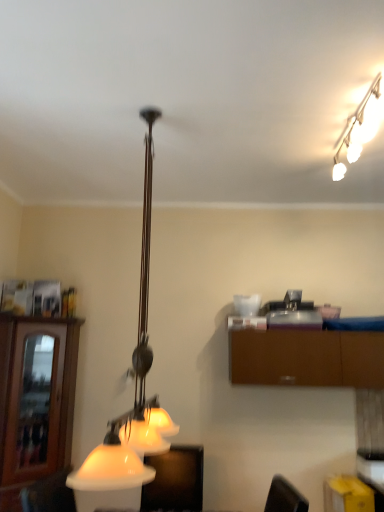
In order to face brown wood cabinet at left, which appears as the 2th cabinetry when viewed from the right, should I rotate leftwards or rightwards?

You should look left and rotate roughly 19.951 degrees.

This screenshot has width=384, height=512. In order to click on white glossy lamp at center, the 2th lamp in the right-to-left sequence in this screenshot , I will do `click(132, 379)`.

Identify the location of brown matte cabinet at upper right, acting as the second cabinetry starting from the left. This screenshot has width=384, height=512. (x=306, y=357).

Find the location of a particular element. The height and width of the screenshot is (512, 384). matte white lampshade at lower center is located at coordinates (175, 480).

The image size is (384, 512). Identify the location of brown wood cabinet at left, which is counted as the 1th cabinetry, starting from the left. (23, 404).

Consider the image. Is white frosted glass light fixture at upper right, which ranks as the 1th lamp in right-to-left order, not inside brown matte cabinet at upper right, acting as the second cabinetry starting from the left?

white frosted glass light fixture at upper right, which ranks as the 1th lamp in right-to-left order, lies outside brown matte cabinet at upper right, acting as the second cabinetry starting from the left,'s area.

In the scene shown: From the image's perspective, is white frosted glass light fixture at upper right, which is counted as the 2th lamp, starting from the left, over brown matte cabinet at upper right, the first cabinetry from the right?

Yes, from the image's perspective, white frosted glass light fixture at upper right, which is counted as the 2th lamp, starting from the left, is over brown matte cabinet at upper right, the first cabinetry from the right.

Would you say white frosted glass light fixture at upper right, which is counted as the 2th lamp, starting from the left, is to the left or to the right of brown matte cabinet at upper right, acting as the second cabinetry starting from the left, in the picture?

In the image, white frosted glass light fixture at upper right, which is counted as the 2th lamp, starting from the left, appears on the left side of brown matte cabinet at upper right, acting as the second cabinetry starting from the left.

Which is closer, (x=336, y=156) or (x=324, y=333)?

The point (x=336, y=156) is closer.

Considering the sizes of objects matte white lampshade at lower center and brown wood cabinet at left, which appears as the 2th cabinetry when viewed from the right, in the image provided, who is thinner, matte white lampshade at lower center or brown wood cabinet at left, which appears as the 2th cabinetry when viewed from the right,?

Thinner between the two is brown wood cabinet at left, which appears as the 2th cabinetry when viewed from the right.

Which object is positioned more to the right, matte white lampshade at lower center or brown wood cabinet at left, which is counted as the 1th cabinetry, starting from the left?

matte white lampshade at lower center is more to the right.

Consider the image. How different are the orientations of matte white lampshade at lower center and brown wood cabinet at left, which is counted as the 1th cabinetry, starting from the left, in degrees?

47.2 degrees.

Are matte white lampshade at lower center and brown wood cabinet at left, which appears as the 2th cabinetry when viewed from the right, far apart?

matte white lampshade at lower center is actually quite close to brown wood cabinet at left, which appears as the 2th cabinetry when viewed from the right.

Looking at this image, can you tell me how much brown wood cabinet at left, which appears as the 2th cabinetry when viewed from the right, and brown matte cabinet at upper right, acting as the second cabinetry starting from the left, differ in facing direction?

42.6 degrees separate the facing orientations of brown wood cabinet at left, which appears as the 2th cabinetry when viewed from the right, and brown matte cabinet at upper right, acting as the second cabinetry starting from the left.

Is brown wood cabinet at left, which is counted as the 1th cabinetry, starting from the left, at the left side of brown matte cabinet at upper right, the first cabinetry from the right?

Yes.

Which of these two, brown wood cabinet at left, which is counted as the 1th cabinetry, starting from the left, or brown matte cabinet at upper right, acting as the second cabinetry starting from the left, is thinner?

brown wood cabinet at left, which is counted as the 1th cabinetry, starting from the left.

Does brown wood cabinet at left, which appears as the 2th cabinetry when viewed from the right, have a greater height compared to brown matte cabinet at upper right, acting as the second cabinetry starting from the left?

Yes.

Which point is more forward, (156,477) or (339,153)?

Point (339,153)

Considering the relative positions of matte white lampshade at lower center and white frosted glass light fixture at upper right, which is counted as the 2th lamp, starting from the left, in the image provided, is matte white lampshade at lower center to the right of white frosted glass light fixture at upper right, which is counted as the 2th lamp, starting from the left, from the viewer's perspective?

Incorrect, matte white lampshade at lower center is not on the right side of white frosted glass light fixture at upper right, which is counted as the 2th lamp, starting from the left.

Consider the image. Does matte white lampshade at lower center come in front of white frosted glass light fixture at upper right, which is counted as the 2th lamp, starting from the left?

No, it is behind white frosted glass light fixture at upper right, which is counted as the 2th lamp, starting from the left.

Identify the location of furniture below the white frosted glass light fixture at upper right, which is counted as the 2th lamp, starting from the left (from the image's perspective). (175, 480).

Is white frosted glass light fixture at upper right, which ranks as the 1th lamp in right-to-left order, taller or shorter than white glossy lamp at center, which ranks as the first lamp in left-to-right order?

In the image, white frosted glass light fixture at upper right, which ranks as the 1th lamp in right-to-left order, appears to be shorter than white glossy lamp at center, which ranks as the first lamp in left-to-right order.

From a real-world perspective, who is located higher, white frosted glass light fixture at upper right, which ranks as the 1th lamp in right-to-left order, or white glossy lamp at center, which ranks as the first lamp in left-to-right order?

white frosted glass light fixture at upper right, which ranks as the 1th lamp in right-to-left order, is physically above.

Is white frosted glass light fixture at upper right, which is counted as the 2th lamp, starting from the left, wider or thinner than white glossy lamp at center, which ranks as the first lamp in left-to-right order?

Considering their sizes, white frosted glass light fixture at upper right, which is counted as the 2th lamp, starting from the left, looks slimmer than white glossy lamp at center, which ranks as the first lamp in left-to-right order.

From the image's perspective, which one is positioned lower, white frosted glass light fixture at upper right, which is counted as the 2th lamp, starting from the left, or white glossy lamp at center, the 2th lamp in the right-to-left sequence?

white glossy lamp at center, the 2th lamp in the right-to-left sequence, appears lower in the image.

Does point (172, 483) appear closer or farther from the camera than point (306, 348)?

Point (172, 483) is closer to the camera than point (306, 348).

From the image's perspective, who appears lower, matte white lampshade at lower center or brown matte cabinet at upper right, the first cabinetry from the right?

matte white lampshade at lower center appears lower in the image.

At what (x,y) coordinates should I click in order to perform the action: click on furniture beneath the brown matte cabinet at upper right, the first cabinetry from the right (from a real-world perspective). Please return your answer as a coordinate pair (x, y). The height and width of the screenshot is (512, 384). Looking at the image, I should click on (175, 480).

Considering the relative sizes of matte white lampshade at lower center and brown matte cabinet at upper right, the first cabinetry from the right, in the image provided, is matte white lampshade at lower center shorter than brown matte cabinet at upper right, the first cabinetry from the right,?

No, matte white lampshade at lower center is not shorter than brown matte cabinet at upper right, the first cabinetry from the right.

Considering the sizes of objects white frosted glass light fixture at upper right, which is counted as the 2th lamp, starting from the left, and matte white lampshade at lower center in the image provided, who is wider, white frosted glass light fixture at upper right, which is counted as the 2th lamp, starting from the left, or matte white lampshade at lower center?

matte white lampshade at lower center is wider.

In the scene shown: Considering the sizes of objects white frosted glass light fixture at upper right, which ranks as the 1th lamp in right-to-left order, and matte white lampshade at lower center in the image provided, who is smaller, white frosted glass light fixture at upper right, which ranks as the 1th lamp in right-to-left order, or matte white lampshade at lower center?

white frosted glass light fixture at upper right, which ranks as the 1th lamp in right-to-left order.

From a real-world perspective, which cabinetry is the 1st one underneath the white frosted glass light fixture at upper right, which ranks as the 1th lamp in right-to-left order? Please provide its 2D coordinates.

[(306, 357)]

Locate an element on the screen. This screenshot has height=512, width=384. cabinetry to the left of matte white lampshade at lower center is located at coordinates (23, 404).

When comparing their distances from white glossy lamp at center, which ranks as the first lamp in left-to-right order, does brown matte cabinet at upper right, the first cabinetry from the right, or white frosted glass light fixture at upper right, which is counted as the 2th lamp, starting from the left, seem further?

The object further to white glossy lamp at center, which ranks as the first lamp in left-to-right order, is white frosted glass light fixture at upper right, which is counted as the 2th lamp, starting from the left.

Estimate the real-world distances between objects in this image. Which object is further from brown matte cabinet at upper right, acting as the second cabinetry starting from the left, white frosted glass light fixture at upper right, which ranks as the 1th lamp in right-to-left order, or matte white lampshade at lower center?

white frosted glass light fixture at upper right, which ranks as the 1th lamp in right-to-left order, is positioned further to the anchor brown matte cabinet at upper right, acting as the second cabinetry starting from the left.

Which object lies nearer to the anchor point white glossy lamp at center, the 2th lamp in the right-to-left sequence, brown matte cabinet at upper right, the first cabinetry from the right, or brown wood cabinet at left, which appears as the 2th cabinetry when viewed from the right?

brown wood cabinet at left, which appears as the 2th cabinetry when viewed from the right, lies closer to white glossy lamp at center, the 2th lamp in the right-to-left sequence, than the other object.

Estimate the real-world distances between objects in this image. Which object is further from matte white lampshade at lower center, brown matte cabinet at upper right, the first cabinetry from the right, or white frosted glass light fixture at upper right, which ranks as the 1th lamp in right-to-left order?

The object further to matte white lampshade at lower center is white frosted glass light fixture at upper right, which ranks as the 1th lamp in right-to-left order.

Looking at the image, which one is located closer to white glossy lamp at center, the 2th lamp in the right-to-left sequence, white frosted glass light fixture at upper right, which is counted as the 2th lamp, starting from the left, or brown matte cabinet at upper right, the first cabinetry from the right?

Based on the image, brown matte cabinet at upper right, the first cabinetry from the right, appears to be nearer to white glossy lamp at center, the 2th lamp in the right-to-left sequence.

Looking at the image, which one is located further to white frosted glass light fixture at upper right, which is counted as the 2th lamp, starting from the left, brown matte cabinet at upper right, acting as the second cabinetry starting from the left, or matte white lampshade at lower center?

matte white lampshade at lower center lies further to white frosted glass light fixture at upper right, which is counted as the 2th lamp, starting from the left, than the other object.

Based on their spatial positions, is matte white lampshade at lower center or white glossy lamp at center, which ranks as the first lamp in left-to-right order, closer to white frosted glass light fixture at upper right, which ranks as the 1th lamp in right-to-left order?

white glossy lamp at center, which ranks as the first lamp in left-to-right order, lies closer to white frosted glass light fixture at upper right, which ranks as the 1th lamp in right-to-left order, than the other object.

Estimate the real-world distances between objects in this image. Which object is further from brown wood cabinet at left, which is counted as the 1th cabinetry, starting from the left, matte white lampshade at lower center or white glossy lamp at center, the 2th lamp in the right-to-left sequence?

white glossy lamp at center, the 2th lamp in the right-to-left sequence, is further to brown wood cabinet at left, which is counted as the 1th cabinetry, starting from the left.

Locate an element on the screen. furniture between white glossy lamp at center, the 2th lamp in the right-to-left sequence, and brown matte cabinet at upper right, acting as the second cabinetry starting from the left, in the front-back direction is located at coordinates (175, 480).

Locate an element on the screen. lamp between white frosted glass light fixture at upper right, which is counted as the 2th lamp, starting from the left, and matte white lampshade at lower center vertically is located at coordinates (132, 379).

Where is `lamp located between brown wood cabinet at left, which is counted as the 1th cabinetry, starting from the left, and white frosted glass light fixture at upper right, which ranks as the 1th lamp in right-to-left order, in the left-right direction`? The image size is (384, 512). lamp located between brown wood cabinet at left, which is counted as the 1th cabinetry, starting from the left, and white frosted glass light fixture at upper right, which ranks as the 1th lamp in right-to-left order, in the left-right direction is located at coordinates (132, 379).

The height and width of the screenshot is (512, 384). Identify the location of furniture situated between brown wood cabinet at left, which is counted as the 1th cabinetry, starting from the left, and brown matte cabinet at upper right, acting as the second cabinetry starting from the left, from left to right. (175, 480).